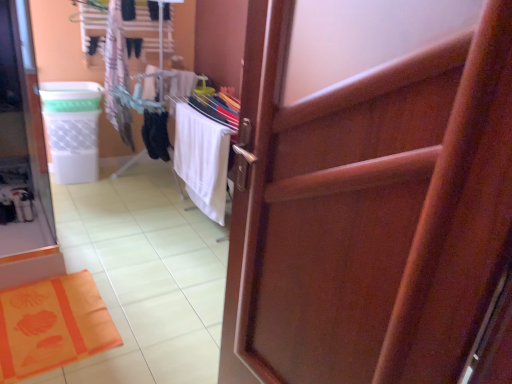
Question: Can you confirm if wooden door at center is shorter than white plastic laundry basket at left?

Choices:
 (A) yes
 (B) no

Answer: (B)

Question: Is wooden door at center thinner than white plastic laundry basket at left?

Choices:
 (A) yes
 (B) no

Answer: (A)

Question: Does wooden door at center contain white plastic laundry basket at left?

Choices:
 (A) yes
 (B) no

Answer: (B)

Question: Is wooden door at center taller than white plastic laundry basket at left?

Choices:
 (A) yes
 (B) no

Answer: (A)

Question: Can you confirm if wooden door at center is bigger than white plastic laundry basket at left?

Choices:
 (A) no
 (B) yes

Answer: (B)

Question: Is wooden door at center wider than white plastic laundry basket at left?

Choices:
 (A) yes
 (B) no

Answer: (B)

Question: Considering the relative sizes of white fabric beach towel at center and orange fabric bath mat at lower left in the image provided, is white fabric beach towel at center taller than orange fabric bath mat at lower left?

Choices:
 (A) no
 (B) yes

Answer: (B)

Question: Are white fabric beach towel at center and orange fabric bath mat at lower left making contact?

Choices:
 (A) no
 (B) yes

Answer: (A)

Question: Is white fabric beach towel at center at the right side of orange fabric bath mat at lower left?

Choices:
 (A) yes
 (B) no

Answer: (A)

Question: Does white fabric beach towel at center lie in front of orange fabric bath mat at lower left?

Choices:
 (A) no
 (B) yes

Answer: (A)

Question: Is orange fabric bath mat at lower left surrounded by white fabric beach towel at center?

Choices:
 (A) no
 (B) yes

Answer: (A)

Question: Is there a large distance between white fabric beach towel at center and orange fabric bath mat at lower left?

Choices:
 (A) yes
 (B) no

Answer: (A)

Question: Could you tell me if white plastic laundry basket at left is turned towards white fabric beach towel at center?

Choices:
 (A) yes
 (B) no

Answer: (B)